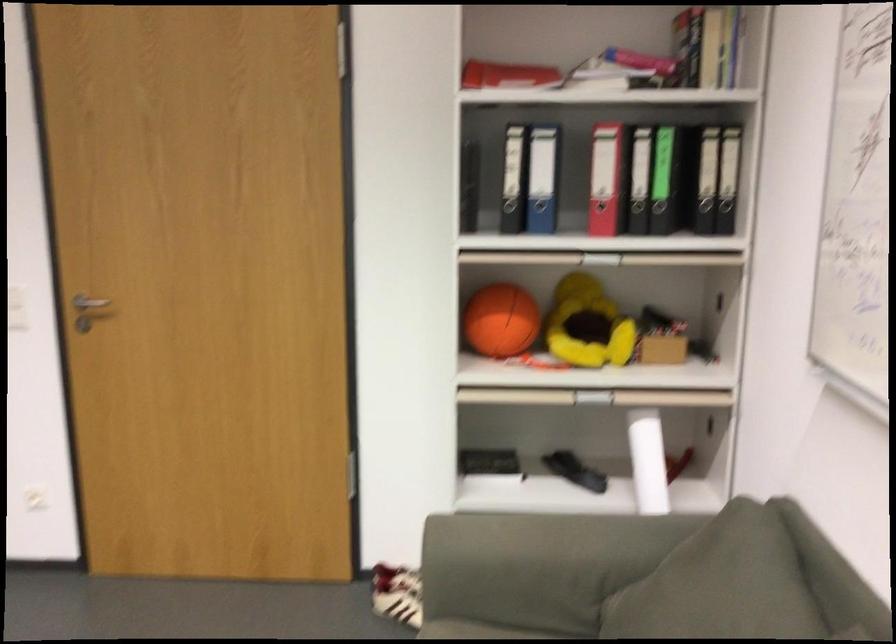
What do you see at coordinates (662, 140) in the screenshot? I see `the green binder hole` at bounding box center [662, 140].